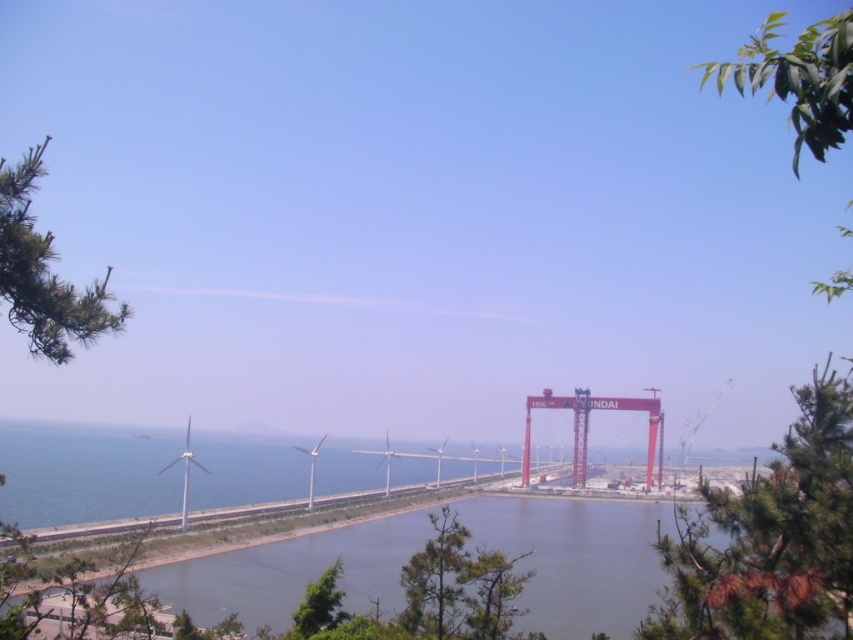
You are a photographer standing at the edge of the water. You want to take a photo that includes both the green pine tree at left and the clear water at lower center. Which object will appear closer to the camera in the photo?

The clear water at lower center will appear closer to the camera because the green pine tree at left is behind it.

You are standing at the edge of the water and want to take a photo of the green leafy tree at upper right without including the clear water at lower center in the frame. Which direction should you move to ensure the tree is visible but the water is out of the shot?

The green leafy tree at upper right is to the right of clear water at lower center. To exclude the water from the frame while keeping the tree visible, you should move to the right side of the current position so that the tree remains in view while the water is no longer in the camera frame.

You are a bird flying over the coastal area and want to land on a tall object. Which object between the green leafy tree at upper right and the clear water at lower center would you choose?

The green leafy tree at upper right is much taller than the clear water at lower center, so the bird should choose the green leafy tree at upper right to land on since it is taller.